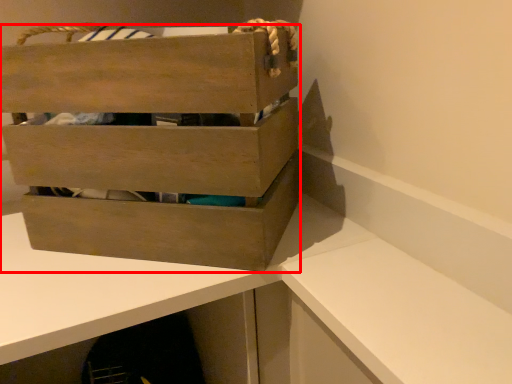
Question: From the image's perspective, considering the relative positions of box (annotated by the red box) and table in the image provided, where is box (annotated by the red box) located with respect to the staircase?

Choices:
 (A) above
 (B) below

Answer: (A)